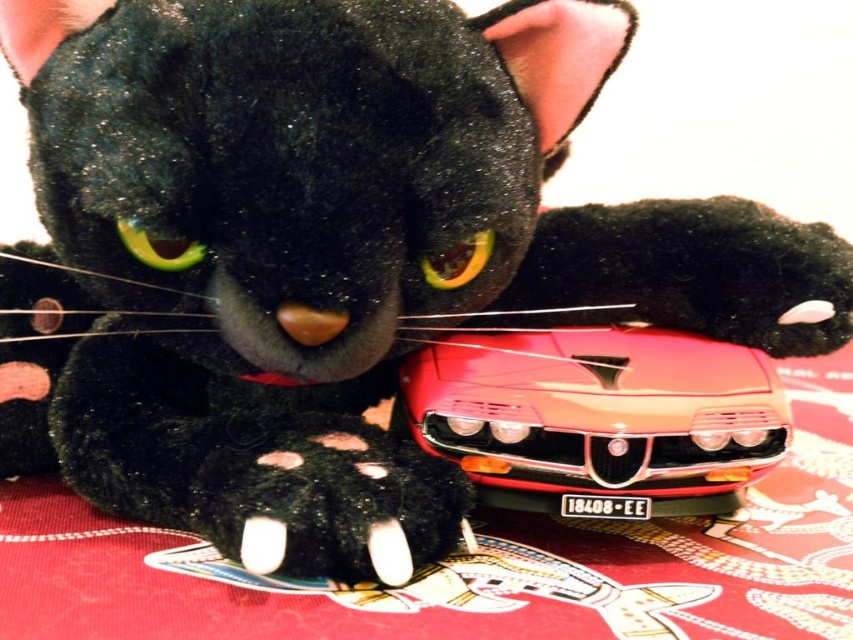
Question: Which object is the closest to the shiny red plastic toy car at center?

Choices:
 (A) red fabric tablecloth at center
 (B) black fuzzy paw at lower center

Answer: (B)

Question: Does red fabric tablecloth at center have a lesser width compared to shiny red plastic toy car at center?

Choices:
 (A) no
 (B) yes

Answer: (A)

Question: Which point is farther to the camera?

Choices:
 (A) (734, 518)
 (B) (566, 468)
 (C) (302, 474)

Answer: (A)

Question: Observing the image, what is the correct spatial positioning of red fabric tablecloth at center in reference to shiny red plastic toy car at center?

Choices:
 (A) below
 (B) above

Answer: (B)

Question: Is red fabric tablecloth at center smaller than shiny red plastic toy car at center?

Choices:
 (A) yes
 (B) no

Answer: (B)

Question: Which point is farther to the camera?

Choices:
 (A) red fabric tablecloth at center
 (B) shiny red plastic toy car at center

Answer: (B)